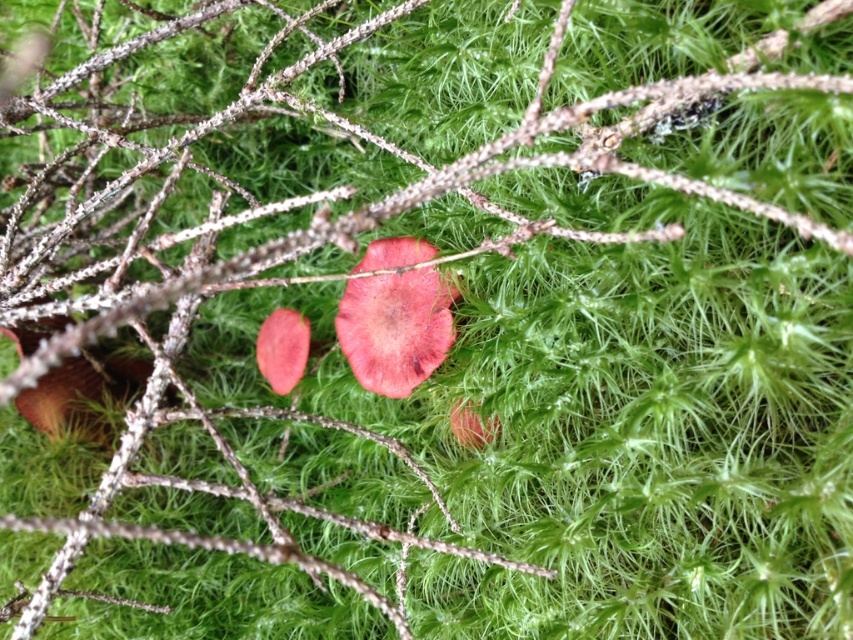
You are an artist sketching this scene. You want to draw the glossy red mushroom at center and the glossy pink petal at center first. Which one should you draw first if you start from the left side of the page?

You should draw the glossy red mushroom at center first because it is located to the left of the glossy pink petal at center.

You are a photographer taking a closeup shot of the mossy ground. You notice the glossy red mushroom at center and the matte pink petal at center. Which object will appear larger in your photo?

The glossy red mushroom at center will appear larger in the photo because it is closer to the viewer than the matte pink petal at center.

You are a botanist examining the natural scene. You notice the glossy red mushroom at center and the glossy pink petal at center. Based on their positions, which one is wider?

The glossy red mushroom at center might be wider than the glossy pink petal at center according to the description.